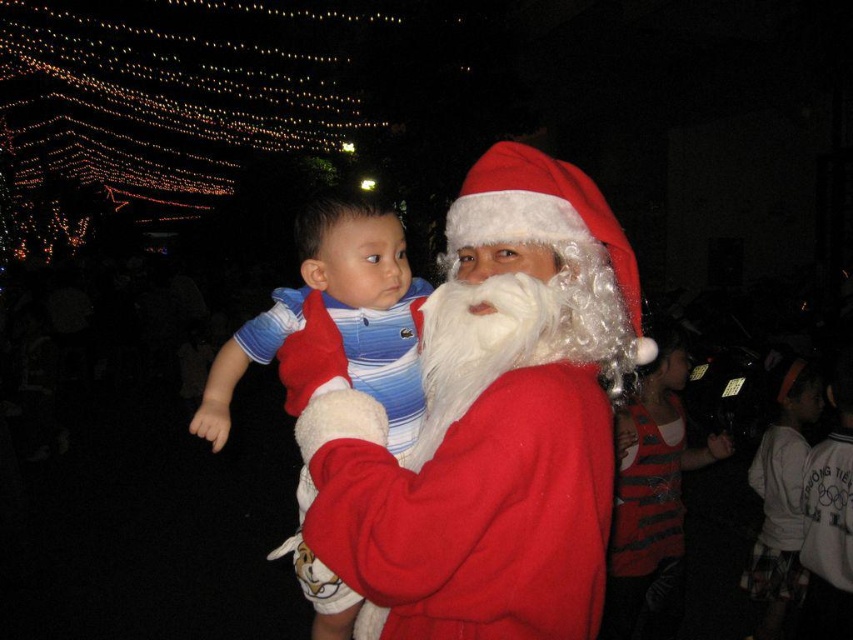
Can you confirm if red velvet santa at center is positioned below blue striped shirt at center?

Incorrect, red velvet santa at center is not positioned below blue striped shirt at center.

Between red velvet santa at center and blue striped shirt at center, which one is positioned lower?

blue striped shirt at center is below.

Is point (351, 481) less distant than point (225, 426)?

Yes, it is.

In order to click on red velvet santa at center in this screenshot , I will do `click(485, 424)`.